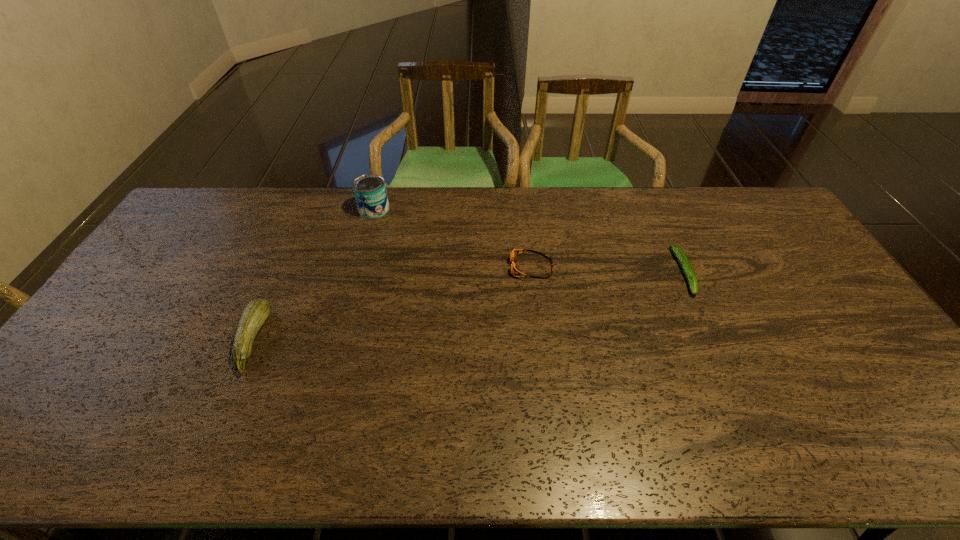
Choose which object is the second nearest neighbor to the shorter zucchini. Please provide its 2D coordinates. Your answer should be formatted as a tuple, i.e. [(x, y)], where the tuple contains the x and y coordinates of a point satisfying the conditions above.

[(370, 192)]

Where is `vacant point that satisfies the following two spatial constraints: 1. on the front-facing side of the shorter zucchini; 2. at the stem end of the leftmost object`? The image size is (960, 540). vacant point that satisfies the following two spatial constraints: 1. on the front-facing side of the shorter zucchini; 2. at the stem end of the leftmost object is located at coordinates pos(715,340).